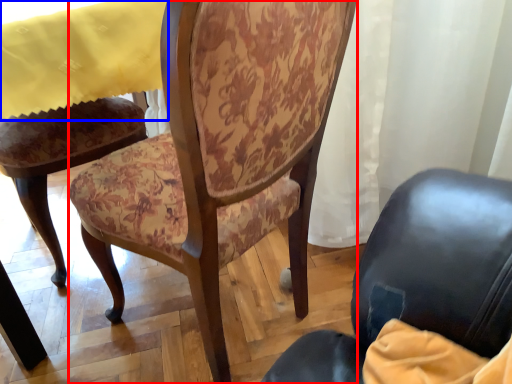
Question: Which object is further to the camera taking this photo, chair (highlighted by a red box) or tablecloth (highlighted by a blue box)?

Choices:
 (A) chair
 (B) tablecloth

Answer: (B)